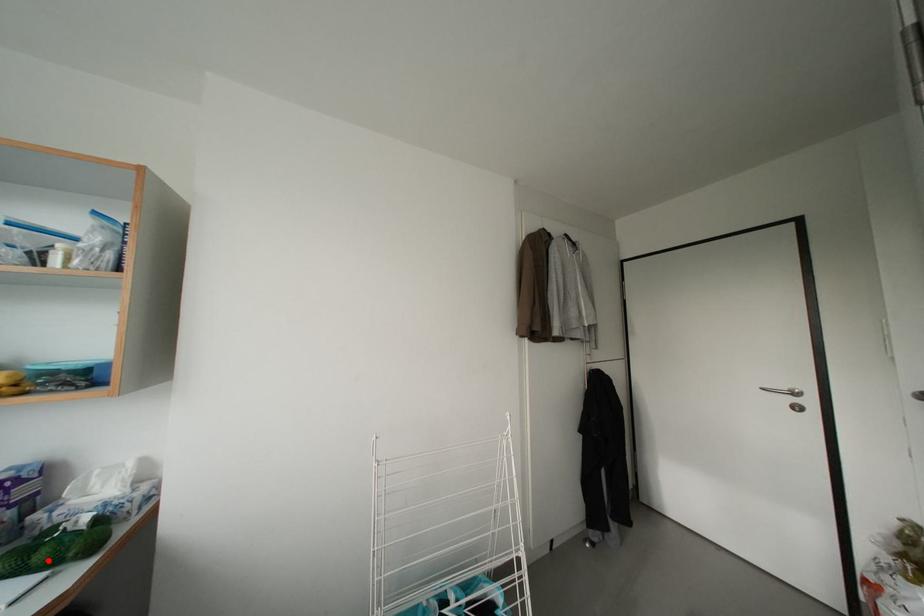
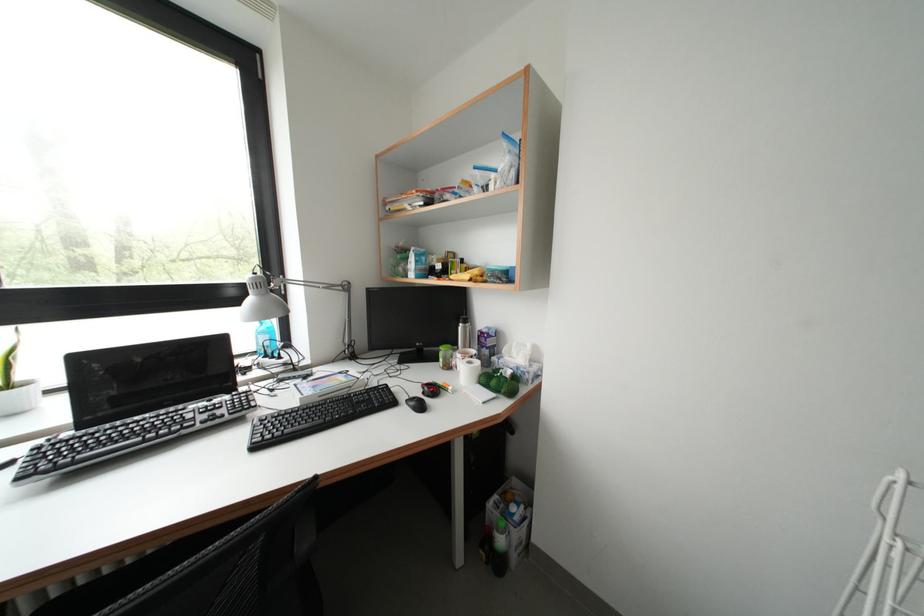
The point at the highlighted location is marked in the first image. Where is the corresponding point in the second image?

(500, 387)